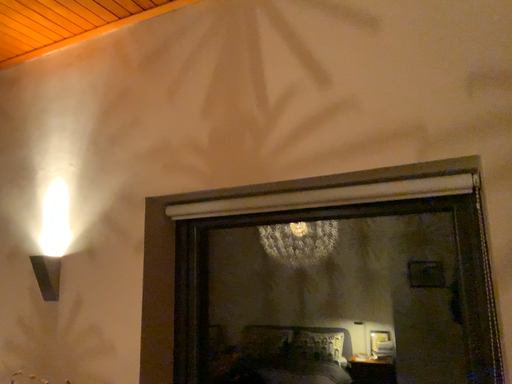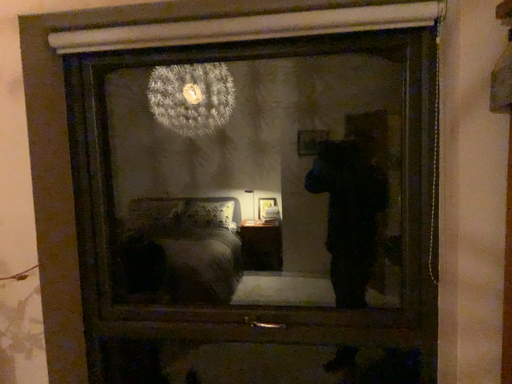
Question: How did the camera likely rotate when shooting the video?

Choices:
 (A) rotated right
 (B) rotated left

Answer: (A)